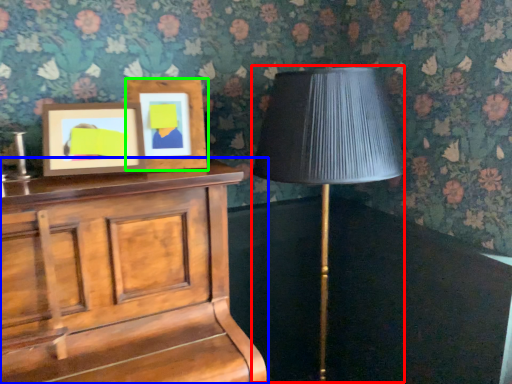
Question: Which object is positioned farthest from table lamp (highlighted by a red box)? Select from furniture (highlighted by a blue box) and picture frame (highlighted by a green box).

Choices:
 (A) furniture
 (B) picture frame

Answer: (A)